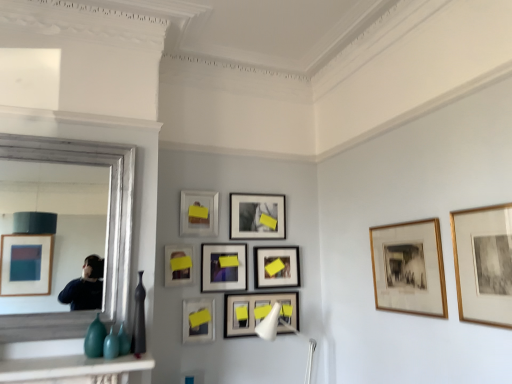
Question: Considering the relative positions of matte black picture frame at center, the seventh picture frame from the back, and matte black picture frame at center, which is the eighth picture frame from front to back, in the image provided, is matte black picture frame at center, the seventh picture frame from the back, to the left of matte black picture frame at center, which is the eighth picture frame from front to back, from the viewer's perspective?

Choices:
 (A) no
 (B) yes

Answer: (B)

Question: Is matte black picture frame at center, the seventh picture frame from the back, bigger than matte black picture frame at center, which is the eighth picture frame from front to back?

Choices:
 (A) no
 (B) yes

Answer: (A)

Question: Can you confirm if matte black picture frame at center, which ranks as the third picture frame in front-to-back order, is wider than matte black picture frame at center, positioned as the 2th picture frame in back-to-front order?

Choices:
 (A) no
 (B) yes

Answer: (B)

Question: Are matte black picture frame at center, which ranks as the third picture frame in front-to-back order, and matte black picture frame at center, positioned as the 2th picture frame in back-to-front order, located far from each other?

Choices:
 (A) no
 (B) yes

Answer: (A)

Question: From a real-world perspective, is matte black picture frame at center, the seventh picture frame from the back, physically above matte black picture frame at center, positioned as the 2th picture frame in back-to-front order?

Choices:
 (A) yes
 (B) no

Answer: (B)

Question: Is matte black picture frame at center, the seventh picture frame from the back, shorter than matte black picture frame at center, positioned as the 2th picture frame in back-to-front order?

Choices:
 (A) yes
 (B) no

Answer: (A)

Question: Does matte black picture frame at center, positioned as the 2th picture frame in back-to-front order, turn towards gold-framed print at right, which is the 9th picture frame in back-to-front order?

Choices:
 (A) yes
 (B) no

Answer: (A)

Question: Is matte black picture frame at center, positioned as the 2th picture frame in back-to-front order, taller than gold-framed print at right, the 1th picture frame from the front?

Choices:
 (A) yes
 (B) no

Answer: (B)

Question: Is matte black picture frame at center, positioned as the 2th picture frame in back-to-front order, at the right side of gold-framed print at right, the 1th picture frame from the front?

Choices:
 (A) yes
 (B) no

Answer: (B)

Question: Is matte black picture frame at center, positioned as the 2th picture frame in back-to-front order, smaller than gold-framed print at right, which is the 9th picture frame in back-to-front order?

Choices:
 (A) yes
 (B) no

Answer: (A)

Question: Are matte black picture frame at center, which is the eighth picture frame from front to back, and gold-framed print at right, the 1th picture frame from the front, beside each other?

Choices:
 (A) no
 (B) yes

Answer: (A)

Question: Is the depth of matte black picture frame at center, positioned as the 2th picture frame in back-to-front order, greater than that of gold-framed print at right, which is the 9th picture frame in back-to-front order?

Choices:
 (A) yes
 (B) no

Answer: (A)

Question: Would you say white plastic lamp at center is part of matte black picture frame at center, which is the eighth picture frame from front to back,'s contents?

Choices:
 (A) no
 (B) yes

Answer: (A)